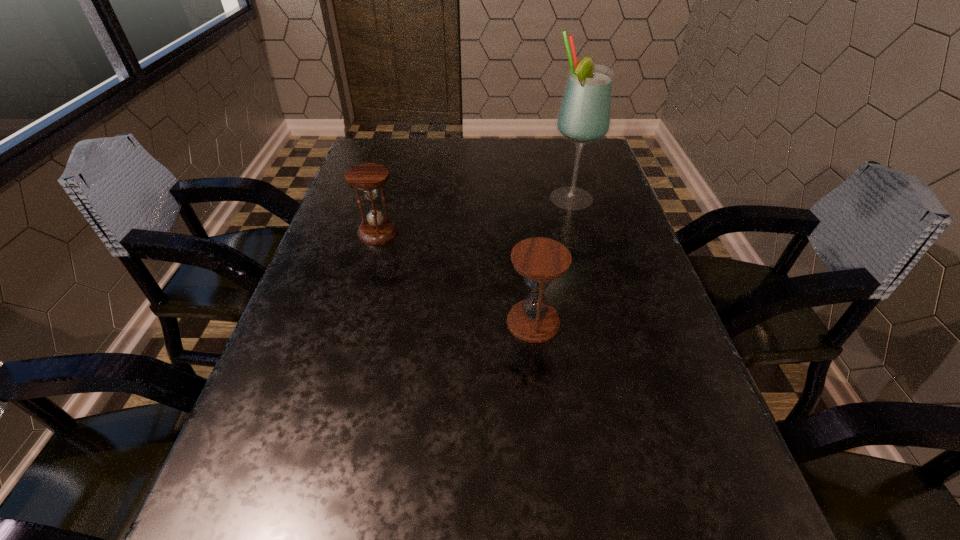
This screenshot has width=960, height=540. Identify the location of the farthest object. (584, 116).

Image resolution: width=960 pixels, height=540 pixels. I want to click on alcohol, so click(x=584, y=116).

Image resolution: width=960 pixels, height=540 pixels. I want to click on the nearer hourglass, so point(539,260).

Where is `the second object from right to left`? This screenshot has height=540, width=960. the second object from right to left is located at coordinates (539, 260).

Find the location of a particular element. This screenshot has width=960, height=540. the farther hourglass is located at coordinates (367, 177).

You are a GUI agent. You are given a task and a screenshot of the screen. Output one action in this format:
    pyautogui.click(x=<x>, y=<y>)
    Task: Click on the leftmost object
    
    Given the screenshot: What is the action you would take?
    pyautogui.click(x=367, y=177)

In order to click on vacant space located on the back of the farthest object in this screenshot , I will do coord(554,138).

Identify the location of free location located on the right of the nearest object. (636, 322).

What are the coordinates of `vacant space located 0.390m on the right of the leftmost object` in the screenshot? It's located at (557, 232).

The height and width of the screenshot is (540, 960). In order to click on object that is at the left edge in this screenshot , I will do `click(367, 177)`.